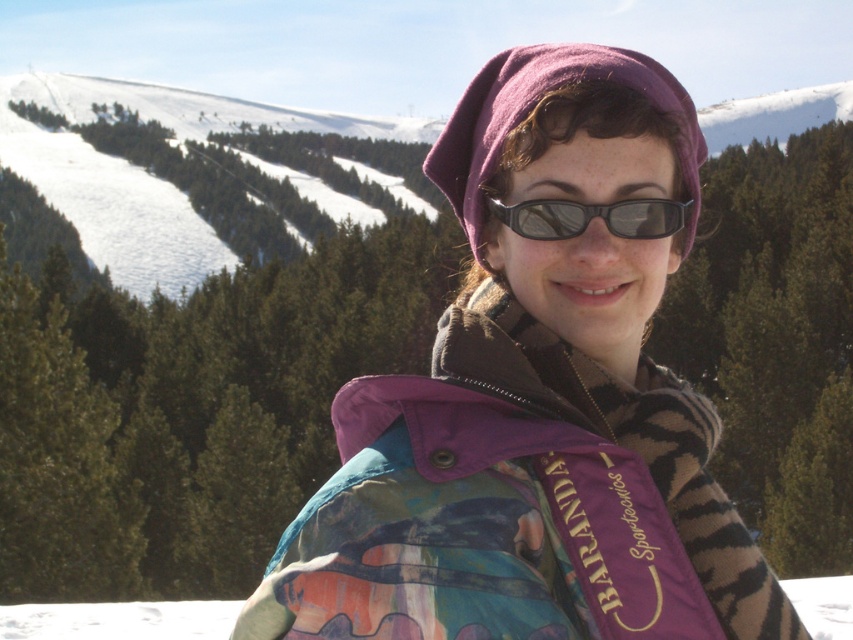
Does purple fleece jacket at center appear over black matte sunglasses at center?

No.

Describe the element at coordinates (534, 403) in the screenshot. The height and width of the screenshot is (640, 853). I see `purple fleece jacket at center` at that location.

Where is `purple fleece jacket at center`? The image size is (853, 640). purple fleece jacket at center is located at coordinates (534, 403).